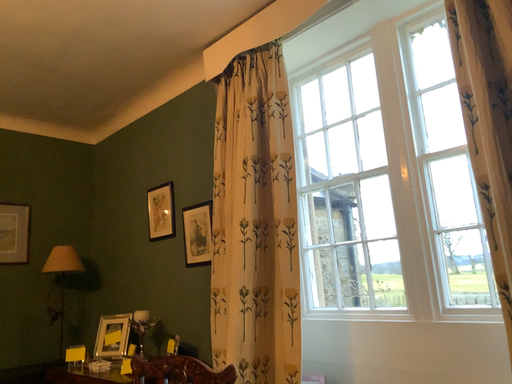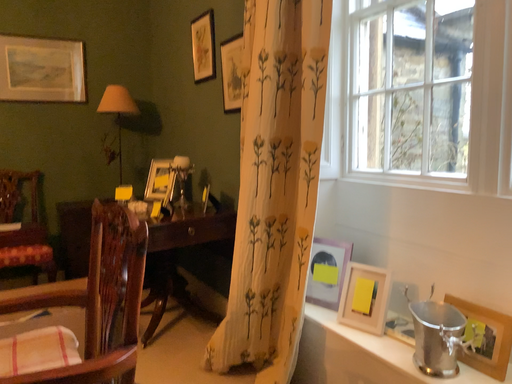
Question: How did the camera likely rotate when shooting the video?

Choices:
 (A) rotated right
 (B) rotated left

Answer: (B)